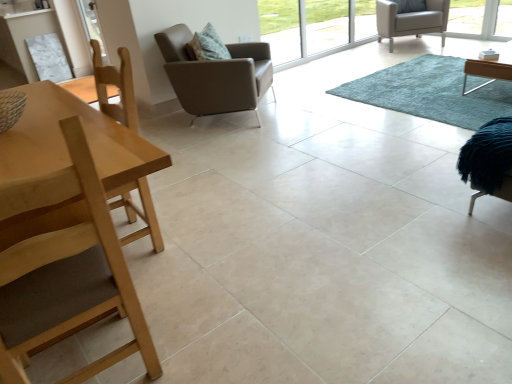
In order to click on free space in front of leather-like brown armchair at center, which ranks as the 2th chair in back-to-front order in this screenshot , I will do `click(228, 142)`.